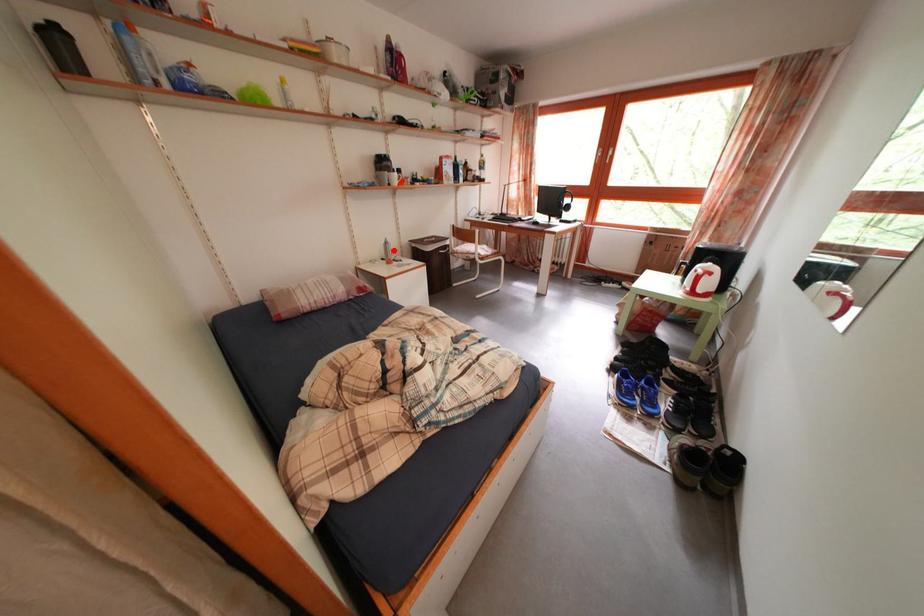
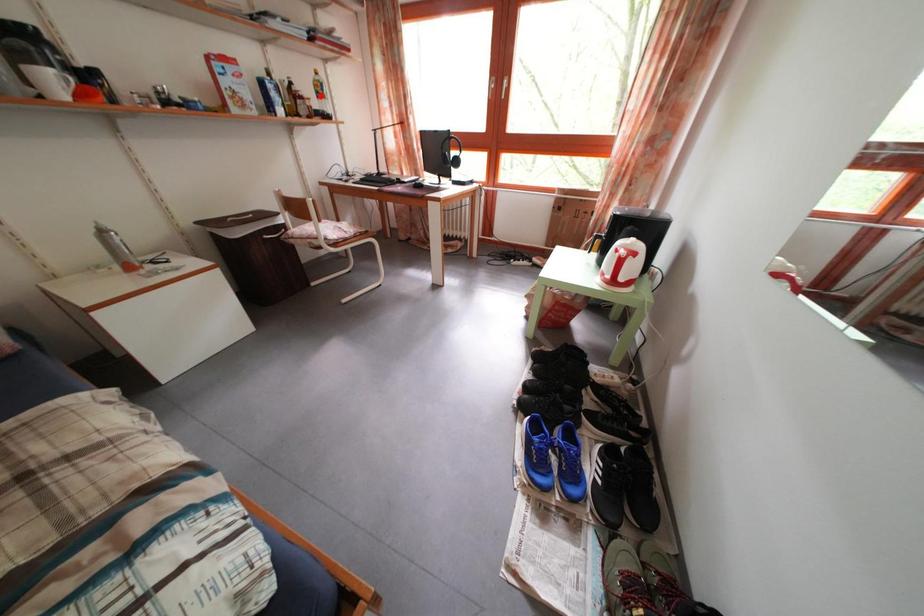
I am providing you with two images of the same scene from different viewpoints. A red point is marked on the first image and another point is marked on the second image. Is the marked point in image1 the same physical position as the marked point in image2?

No